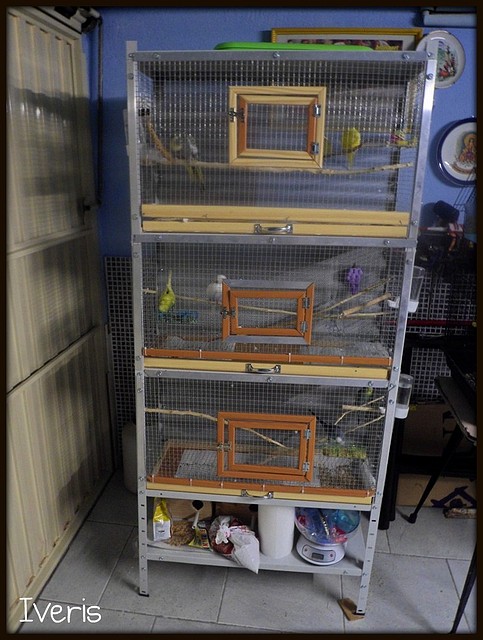
You are a GUI agent. You are given a task and a screenshot of the screen. Output one action in this format:
    pyautogui.click(x=<x>, y=<y>)
    Task: Click on the branch\bottom shelf
    The height and width of the screenshot is (640, 483).
    Given the screenshot: What is the action you would take?
    pyautogui.click(x=342, y=173), pyautogui.click(x=298, y=557)